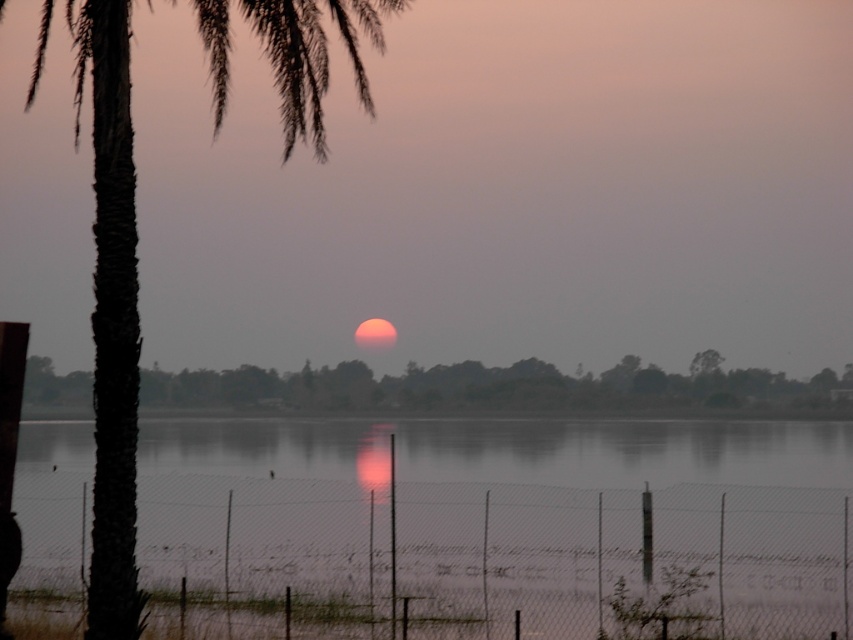
You are a GUI agent. You are given a task and a screenshot of the screen. Output one action in this format:
    pyautogui.click(x=<x>, y=<y>)
    Task: Click on the wire mesh fence at lower center
    
    Given the screenshot: What is the action you would take?
    pyautogui.click(x=624, y=560)

Can you confirm if wire mesh fence at lower center is wider than green leafy tree at center?

Incorrect, wire mesh fence at lower center's width does not surpass green leafy tree at center's.

Is point (369, 557) positioned behind point (262, 397)?

No.

Where is `wire mesh fence at lower center`? Image resolution: width=853 pixels, height=640 pixels. wire mesh fence at lower center is located at coordinates (624, 560).

This screenshot has height=640, width=853. What do you see at coordinates (624, 560) in the screenshot?
I see `wire mesh fence at lower center` at bounding box center [624, 560].

Describe the element at coordinates (624, 560) in the screenshot. I see `wire mesh fence at lower center` at that location.

I want to click on wire mesh fence at lower center, so click(624, 560).

Based on the photo, who is positioned more to the right, dark brown textured palm tree at left or green leafy tree at center?

Positioned to the right is green leafy tree at center.

What do you see at coordinates (111, 312) in the screenshot? I see `dark brown textured palm tree at left` at bounding box center [111, 312].

Where is `dark brown textured palm tree at left`? The height and width of the screenshot is (640, 853). dark brown textured palm tree at left is located at coordinates (111, 312).